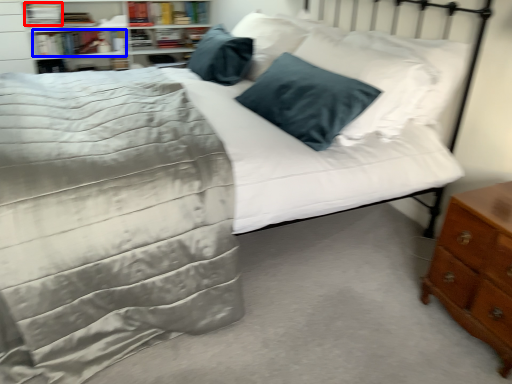
Question: Among these objects, which one is farthest to the camera, book (highlighted by a red box) or book (highlighted by a blue box)?

Choices:
 (A) book
 (B) book

Answer: (B)